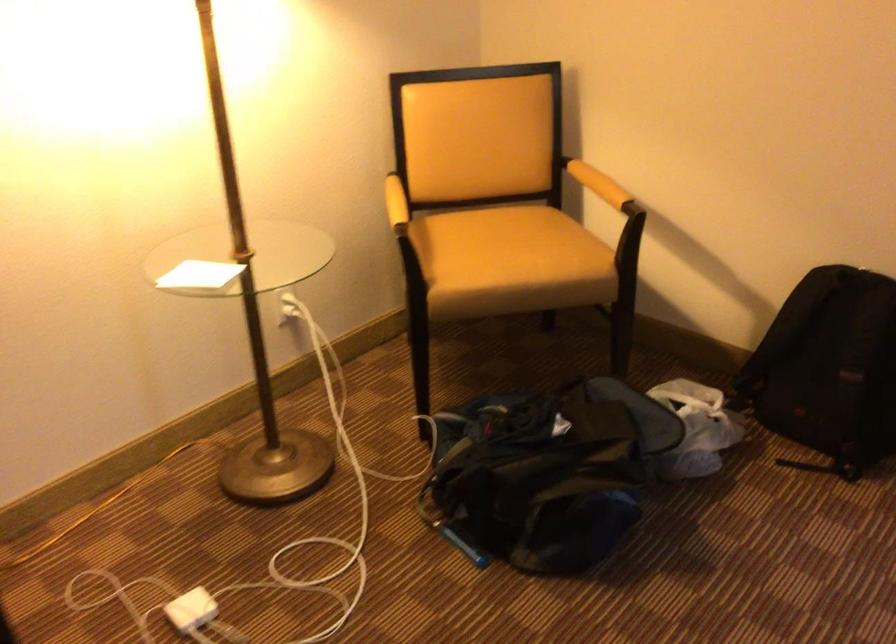
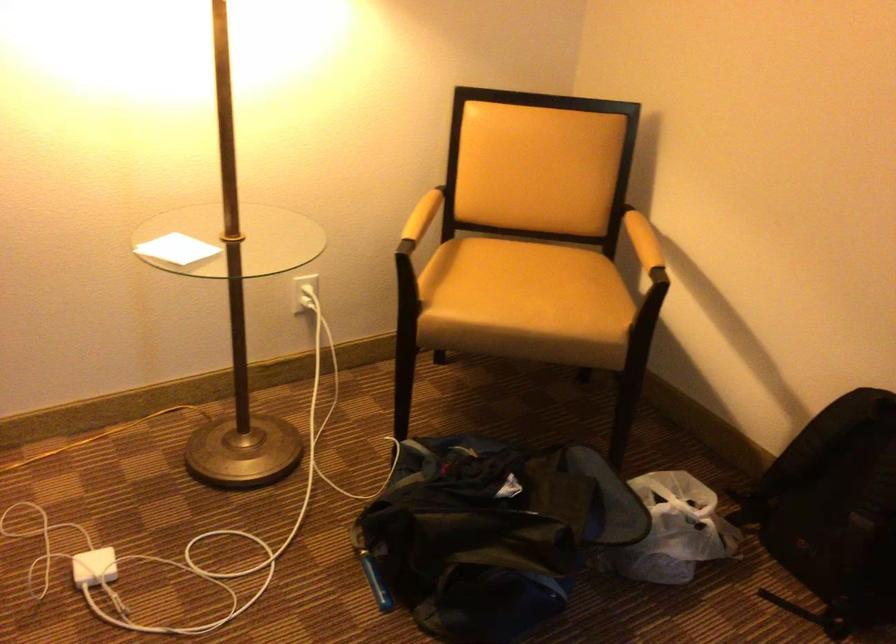
Question: The camera is either moving clockwise (left) or counter-clockwise (right) around the object. The first image is from the beginning of the video and the second image is from the end. Is the camera moving left or right when shooting the video?

Choices:
 (A) Left
 (B) Right

Answer: (B)